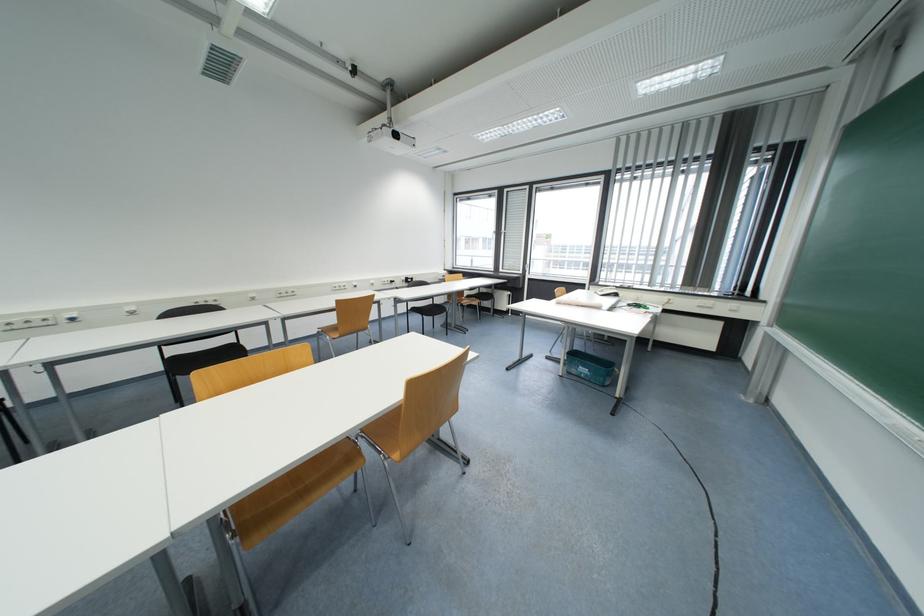
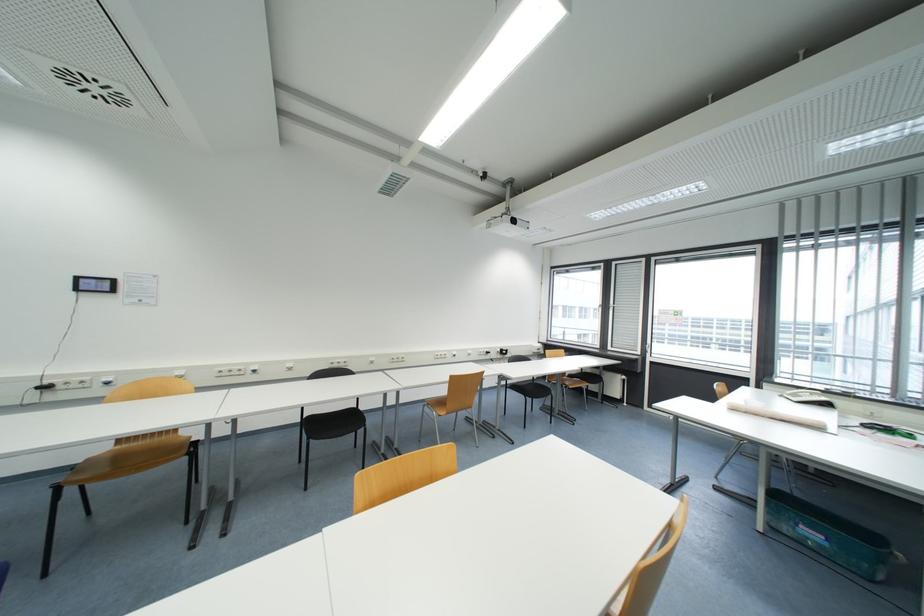
Question: Based on the continuous images, in which direction is the camera rotating? Reply with the corresponding letter.

Choices:
 (A) Left
 (B) Right
 (C) Up
 (D) Down

Answer: (A)